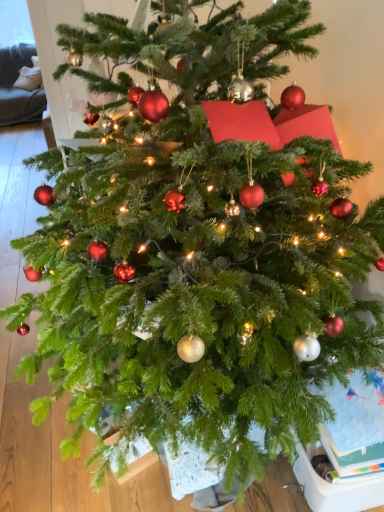
Where is `blue cardboard box at lower right`? blue cardboard box at lower right is located at coordinates (348, 449).

The width and height of the screenshot is (384, 512). What do you see at coordinates (348, 449) in the screenshot?
I see `blue cardboard box at lower right` at bounding box center [348, 449].

Locate an element on the screen. This screenshot has width=384, height=512. blue cardboard box at lower right is located at coordinates (348, 449).